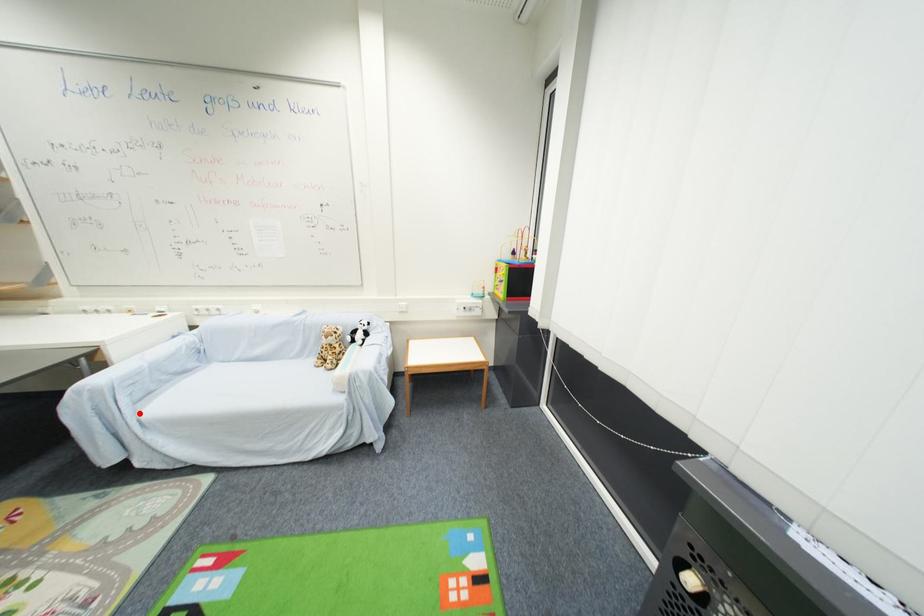
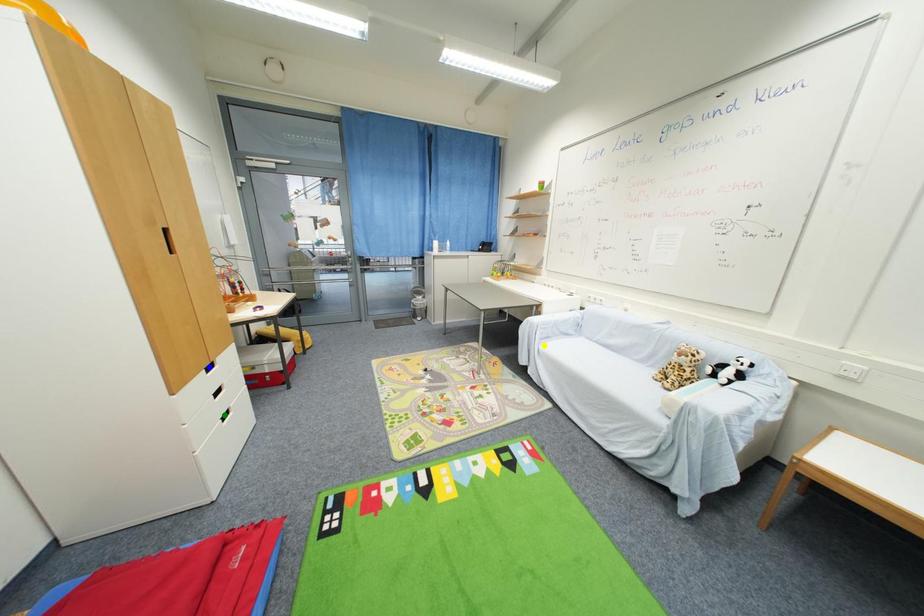
Question: I am providing you with two images of the same scene from different viewpoints. A red point is marked on the first image. You are given multiple points on the second image. Which mark in image 2 goes with the point in image 1?

Choices:
 (A) yellow point
 (B) blue point
 (C) green point

Answer: (A)